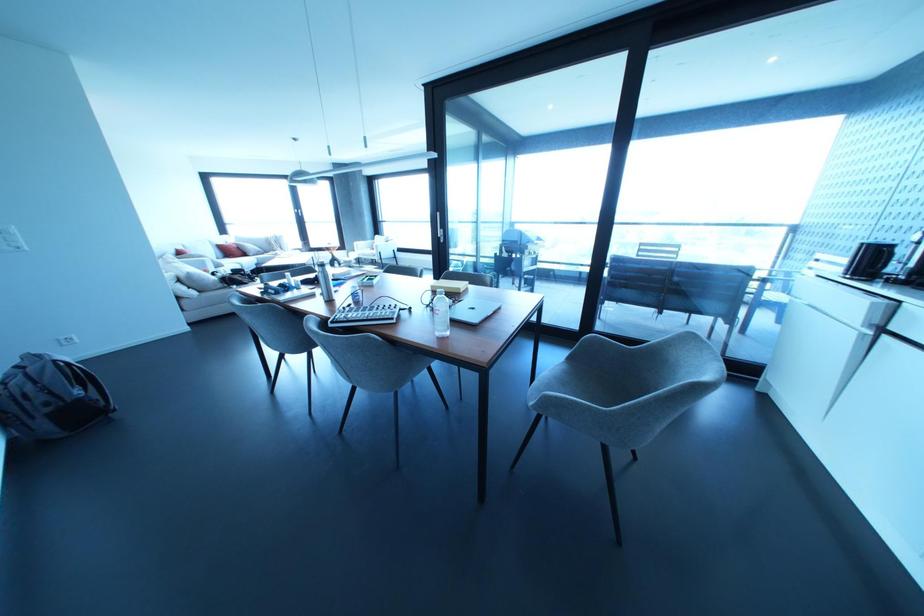
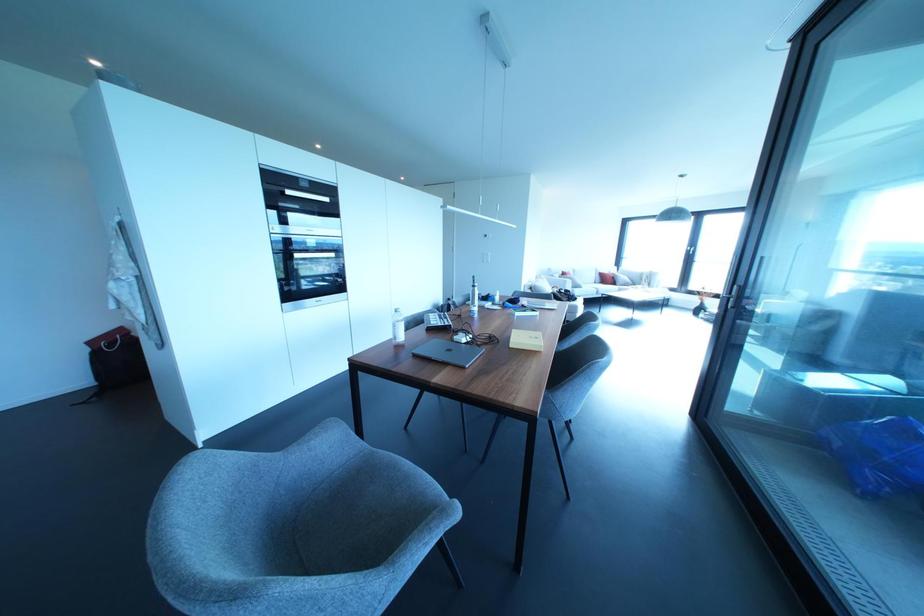
Where in the second image is the point corresponding to (x=460, y=291) from the first image?

(511, 345)